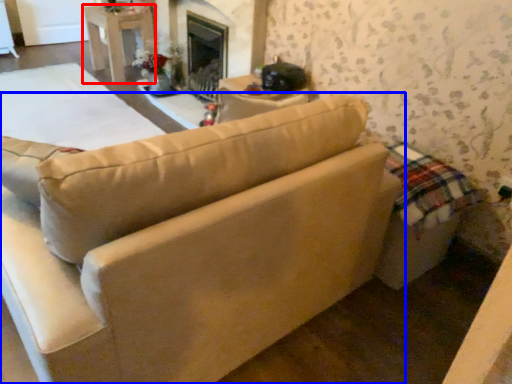
Question: Among these objects, which one is nearest to the camera, table (highlighted by a red box) or studio couch (highlighted by a blue box)?

Choices:
 (A) table
 (B) studio couch

Answer: (B)